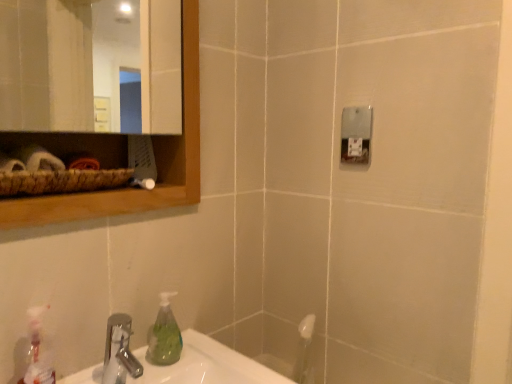
Image resolution: width=512 pixels, height=384 pixels. Find the location of `wooden mirror at upper left`. wooden mirror at upper left is located at coordinates (90, 65).

The width and height of the screenshot is (512, 384). Describe the element at coordinates (37, 351) in the screenshot. I see `translucent plastic spray bottle at lower left` at that location.

The width and height of the screenshot is (512, 384). Find the location of `silver metallic faucet at lower left`. silver metallic faucet at lower left is located at coordinates (119, 351).

You are a GUI agent. You are given a task and a screenshot of the screen. Output one action in this format:
    pyautogui.click(x=<x>, y=<y>)
    Task: Click on the green translucent soap dispenser at lower left
    The image size is (512, 384).
    Given the screenshot: What is the action you would take?
    pyautogui.click(x=164, y=335)

Is translucent plastic spray bottle at lower left oriented away from wooden mirror at upper left?

No, translucent plastic spray bottle at lower left is not facing away from wooden mirror at upper left.

Would you say translucent plastic spray bottle at lower left contains wooden mirror at upper left?

No, wooden mirror at upper left is not a part of translucent plastic spray bottle at lower left.

Consider the image. From a real-world perspective, relative to wooden mirror at upper left, is translucent plastic spray bottle at lower left vertically above or below?

Clearly, from a real-world perspective, translucent plastic spray bottle at lower left is below wooden mirror at upper left.

Between translucent plastic spray bottle at lower left and wooden mirror at upper left, which one has larger width?

translucent plastic spray bottle at lower left.

Who is taller, silver metallic faucet at lower left or green translucent soap dispenser at lower left?

With more height is green translucent soap dispenser at lower left.

From the image's perspective, does silver metallic faucet at lower left appear lower than green translucent soap dispenser at lower left?

Yes, from the image's perspective, silver metallic faucet at lower left is beneath green translucent soap dispenser at lower left.

How different are the orientations of silver metallic faucet at lower left and green translucent soap dispenser at lower left in degrees?

The angular difference between silver metallic faucet at lower left and green translucent soap dispenser at lower left is 0.00237 degrees.

Is green translucent soap dispenser at lower left at the back of silver metallic faucet at lower left?

No, silver metallic faucet at lower left's orientation is not away from green translucent soap dispenser at lower left.

Based on their sizes in the image, would you say wooden mirror at upper left is bigger or smaller than silver metallic faucet at lower left?

Clearly, wooden mirror at upper left is larger in size than silver metallic faucet at lower left.

Considering the positions of points (19, 27) and (106, 336), is point (19, 27) closer to camera compared to point (106, 336)?

No.

Looking at this image, between translucent plastic spray bottle at lower left and green translucent soap dispenser at lower left, which one has larger width?

green translucent soap dispenser at lower left is wider.

Where is `cleaning product located below the green translucent soap dispenser at lower left (from the image's perspective)`? The height and width of the screenshot is (384, 512). cleaning product located below the green translucent soap dispenser at lower left (from the image's perspective) is located at coordinates (37, 351).

Consider the image. Can we say translucent plastic spray bottle at lower left lies outside green translucent soap dispenser at lower left?

Yes, translucent plastic spray bottle at lower left is outside of green translucent soap dispenser at lower left.

Can you see wooden mirror at upper left touching translucent plastic spray bottle at lower left?

wooden mirror at upper left and translucent plastic spray bottle at lower left are clearly separated.

From a real-world perspective, is wooden mirror at upper left under translucent plastic spray bottle at lower left?

No, from a real-world perspective, wooden mirror at upper left is not below translucent plastic spray bottle at lower left.

From the image's perspective, relative to translucent plastic spray bottle at lower left, is wooden mirror at upper left above or below?

wooden mirror at upper left is situated higher than translucent plastic spray bottle at lower left in the image.

Can you confirm if wooden mirror at upper left is taller than translucent plastic spray bottle at lower left?

Indeed, wooden mirror at upper left has a greater height compared to translucent plastic spray bottle at lower left.

Considering the sizes of objects wooden mirror at upper left and green translucent soap dispenser at lower left in the image provided, who is bigger, wooden mirror at upper left or green translucent soap dispenser at lower left?

wooden mirror at upper left.

Based on the photo, is wooden mirror at upper left spatially inside green translucent soap dispenser at lower left, or outside of it?

wooden mirror at upper left is located beyond the bounds of green translucent soap dispenser at lower left.

Does wooden mirror at upper left come behind green translucent soap dispenser at lower left?

No, the depth of wooden mirror at upper left is less than that of green translucent soap dispenser at lower left.

Is wooden mirror at upper left far away from green translucent soap dispenser at lower left?

That's right, there is a large distance between wooden mirror at upper left and green translucent soap dispenser at lower left.

Considering the relative sizes of silver metallic faucet at lower left and wooden mirror at upper left in the image provided, is silver metallic faucet at lower left wider than wooden mirror at upper left?

Correct, the width of silver metallic faucet at lower left exceeds that of wooden mirror at upper left.

Considering the positions of objects silver metallic faucet at lower left and wooden mirror at upper left in the image provided, who is more to the right, silver metallic faucet at lower left or wooden mirror at upper left?

From the viewer's perspective, silver metallic faucet at lower left appears more on the right side.

From the image's perspective, who appears lower, silver metallic faucet at lower left or wooden mirror at upper left?

silver metallic faucet at lower left, from the image's perspective.

Would you say silver metallic faucet at lower left contains wooden mirror at upper left?

No.

You are a GUI agent. You are given a task and a screenshot of the screen. Output one action in this format:
    pyautogui.click(x=<x>, y=<y>)
    Task: Click on the mirror in front of the translucent plastic spray bottle at lower left
    The width and height of the screenshot is (512, 384).
    Given the screenshot: What is the action you would take?
    pyautogui.click(x=90, y=65)

In the image, there is a green translucent soap dispenser at lower left. Where is `tap below it (from a real-world perspective)`? tap below it (from a real-world perspective) is located at coordinates (119, 351).

When comparing their distances from silver metallic faucet at lower left, does wooden mirror at upper left or green translucent soap dispenser at lower left seem further?

wooden mirror at upper left is positioned further to the anchor silver metallic faucet at lower left.

Looking at the image, which one is located closer to translucent plastic spray bottle at lower left, wooden mirror at upper left or green translucent soap dispenser at lower left?

green translucent soap dispenser at lower left.

When comparing their distances from silver metallic faucet at lower left, does translucent plastic spray bottle at lower left or wooden mirror at upper left seem closer?

translucent plastic spray bottle at lower left lies closer to silver metallic faucet at lower left than the other object.

Estimate the real-world distances between objects in this image. Which object is further from silver metallic faucet at lower left, wooden mirror at upper left or translucent plastic spray bottle at lower left?

wooden mirror at upper left is positioned further to the anchor silver metallic faucet at lower left.

Consider the image. Considering their positions, is wooden mirror at upper left positioned closer to green translucent soap dispenser at lower left than silver metallic faucet at lower left?

silver metallic faucet at lower left is positioned closer to the anchor green translucent soap dispenser at lower left.

Which object lies further to the anchor point wooden mirror at upper left, translucent plastic spray bottle at lower left or green translucent soap dispenser at lower left?

Among the two, translucent plastic spray bottle at lower left is located further to wooden mirror at upper left.

Looking at the image, which one is located further to wooden mirror at upper left, silver metallic faucet at lower left or green translucent soap dispenser at lower left?

silver metallic faucet at lower left lies further to wooden mirror at upper left than the other object.

Estimate the real-world distances between objects in this image. Which object is closer to wooden mirror at upper left, green translucent soap dispenser at lower left or translucent plastic spray bottle at lower left?

green translucent soap dispenser at lower left lies closer to wooden mirror at upper left than the other object.

This screenshot has width=512, height=384. Identify the location of soap dispenser between wooden mirror at upper left and silver metallic faucet at lower left from top to bottom. (164, 335).

Find the location of a particular element. Image resolution: width=512 pixels, height=384 pixels. soap dispenser that lies between wooden mirror at upper left and translucent plastic spray bottle at lower left from top to bottom is located at coordinates (164, 335).

Where is `tap between translucent plastic spray bottle at lower left and green translucent soap dispenser at lower left`? tap between translucent plastic spray bottle at lower left and green translucent soap dispenser at lower left is located at coordinates (119, 351).

Locate an element on the screen. The width and height of the screenshot is (512, 384). cleaning product that lies between wooden mirror at upper left and silver metallic faucet at lower left from top to bottom is located at coordinates (37, 351).